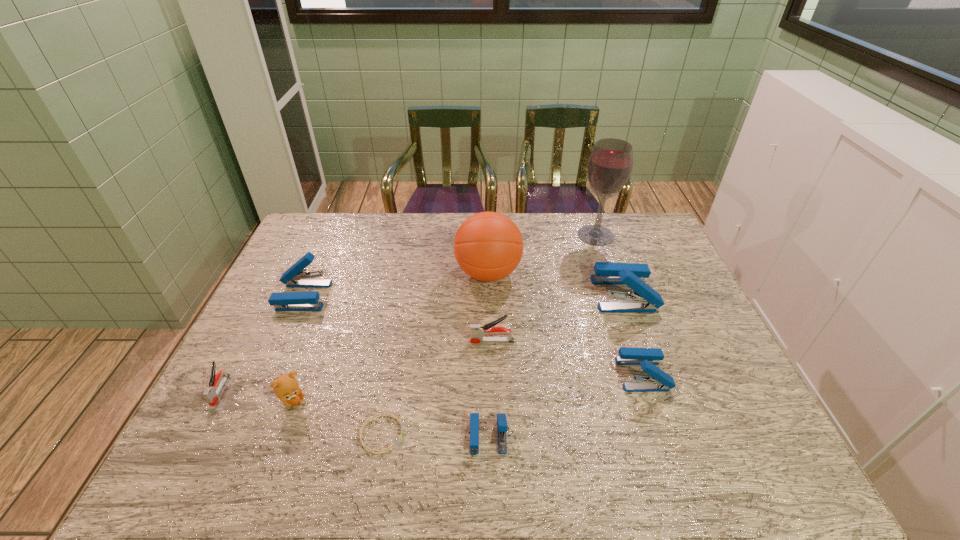
The height and width of the screenshot is (540, 960). I want to click on stapler that is the fifth closest to the teddy bear, so click(x=660, y=381).

Locate which blue stapler ranks third in proximity to the orange basketball. Please provide its 2D coordinates. Your answer should be formatted as a tuple, i.e. [(x, y)], where the tuple contains the x and y coordinates of a point satisfying the conditions above.

[(295, 277)]

You are a GUI agent. You are given a task and a screenshot of the screen. Output one action in this format:
    pyautogui.click(x=<x>, y=<y>)
    Task: Click on the blue stapler that is the third nearest to the farthest object
    Image resolution: width=960 pixels, height=540 pixels.
    Given the screenshot: What is the action you would take?
    pyautogui.click(x=502, y=427)

Locate an element on the screen. The width and height of the screenshot is (960, 540). free point that satisfies the following two spatial constraints: 1. on the surface of the nearest blue stapler showing star-shaped elements; 2. on the right side of the seventh object from right to left is located at coordinates (381, 436).

The width and height of the screenshot is (960, 540). Find the location of `vacant region that satisfies the following two spatial constraints: 1. on the surface of the nearest stapler showing star-shaped elements; 2. on the left side of the blue bracelet`. vacant region that satisfies the following two spatial constraints: 1. on the surface of the nearest stapler showing star-shaped elements; 2. on the left side of the blue bracelet is located at coordinates (381, 436).